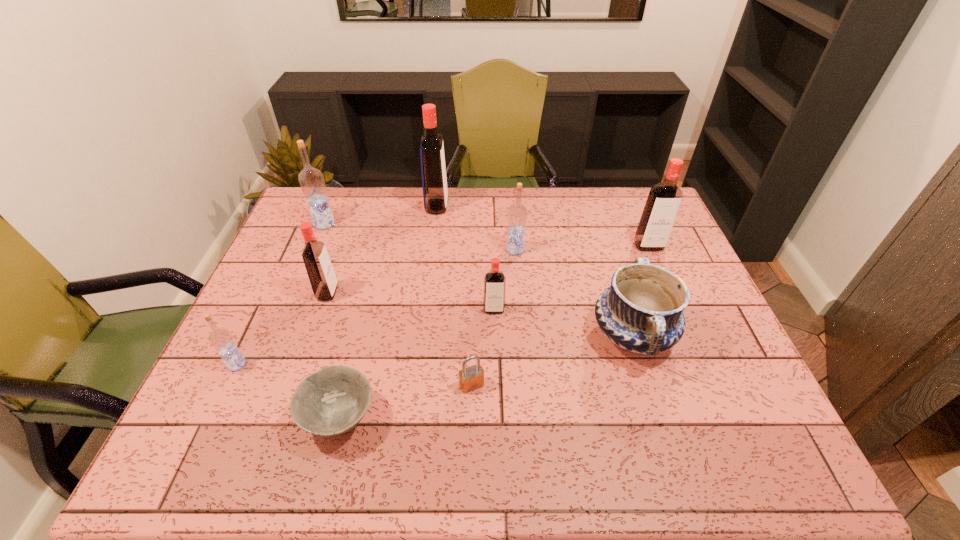
At what (x,y) coordinates should I click in order to perform the action: click on empty space between the third vodka from right to left and the third nearest red vodka. Please return your answer as a coordinate pair (x, y). The image size is (960, 540). Looking at the image, I should click on (571, 278).

Where is `free point between the biggest red vodka and the sixth farthest vodka`? The image size is (960, 540). free point between the biggest red vodka and the sixth farthest vodka is located at coordinates (466, 258).

You are a GUI agent. You are given a task and a screenshot of the screen. Output one action in this format:
    pyautogui.click(x=<x>, y=<y>)
    Task: Click on the free space between the padlock and the shortest object
    The height and width of the screenshot is (540, 960).
    Given the screenshot: What is the action you would take?
    pyautogui.click(x=406, y=401)

The height and width of the screenshot is (540, 960). Identify the location of empty space between the farthest blue vodka and the sixth farthest vodka. (409, 267).

The width and height of the screenshot is (960, 540). I want to click on free space between the third vodka from right to left and the shortest object, so click(417, 364).

Where is `the second closest object relative to the farthest red vodka`? the second closest object relative to the farthest red vodka is located at coordinates (311, 180).

The height and width of the screenshot is (540, 960). In order to click on object that is the sixth closest to the ninth tallest object in this screenshot , I will do `click(221, 339)`.

I want to click on vodka that is the third closest one to the seventh object from right to left, so click(494, 281).

I want to click on the fourth closest vodka to the leftmost red vodka, so click(494, 281).

Image resolution: width=960 pixels, height=540 pixels. In order to click on red vodka that is the third nearest to the eighth object from right to left in this screenshot , I will do `click(663, 202)`.